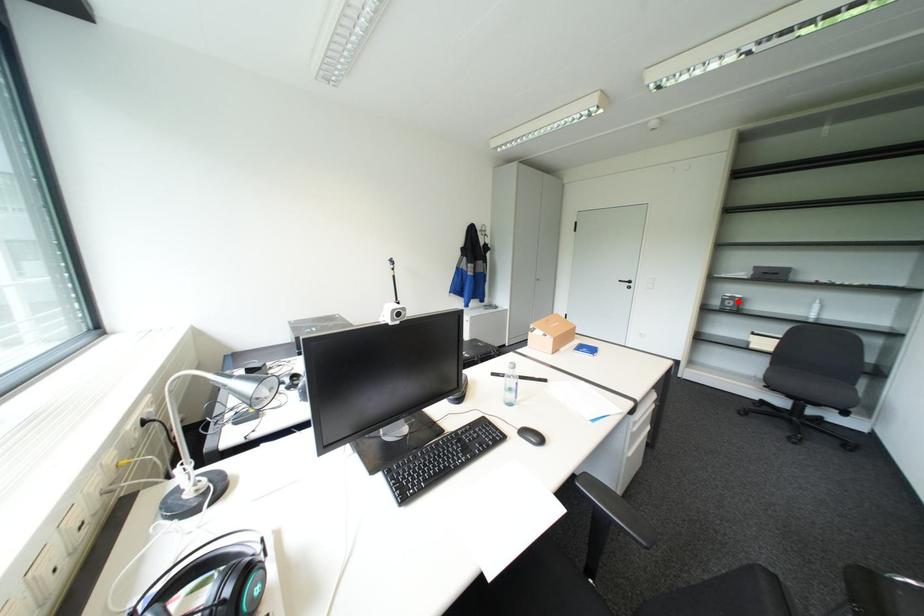
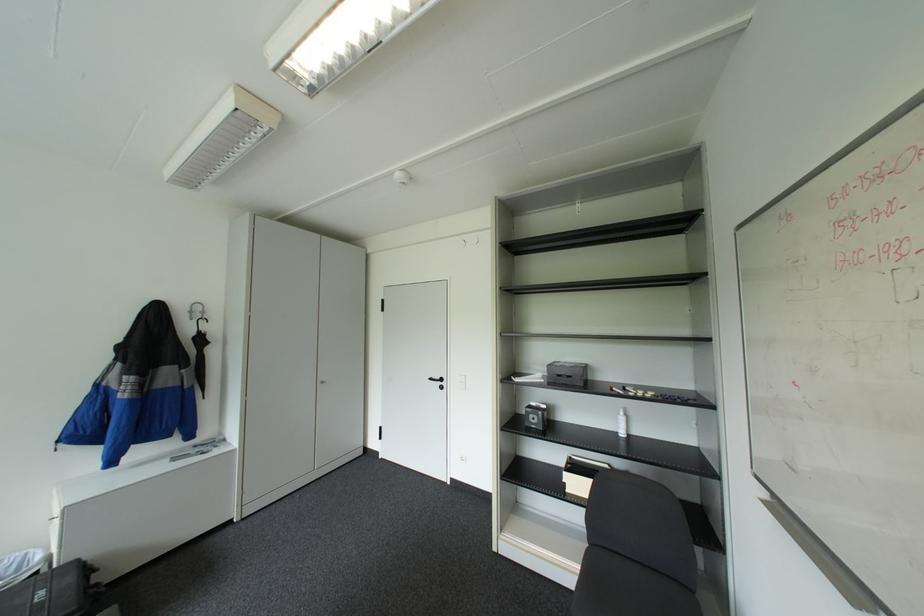
Where in the second image is the point corresponding to the highlighted location from the first image?

(541, 416)